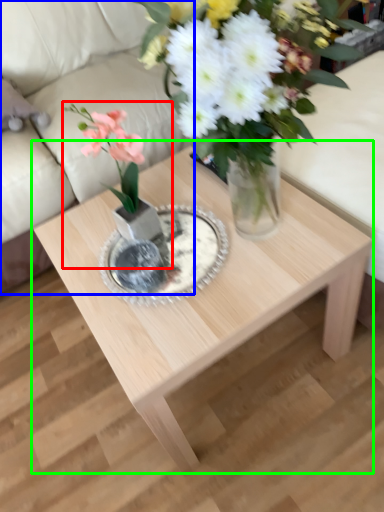
Question: Based on their relative distances, which object is nearer to houseplant (highlighted by a red box)? Choose from couch (highlighted by a blue box) and coffee table (highlighted by a green box).

Choices:
 (A) couch
 (B) coffee table

Answer: (B)